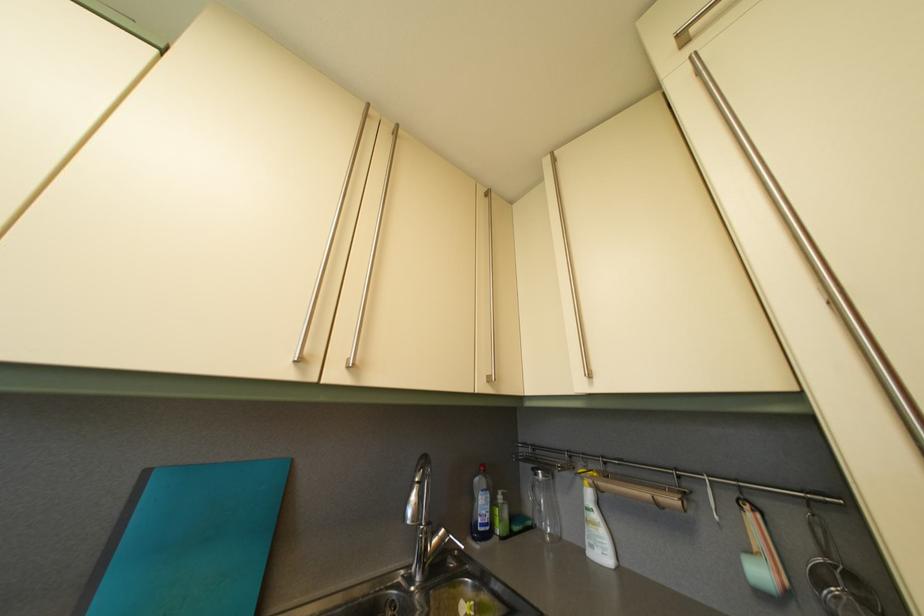
You are a GUI agent. You are given a task and a screenshot of the screen. Output one action in this format:
    pyautogui.click(x=<x>, y=<y>)
    Task: Click on the soap dispenser pump
    The width and height of the screenshot is (924, 616).
    Given the screenshot: What is the action you would take?
    pyautogui.click(x=501, y=495)